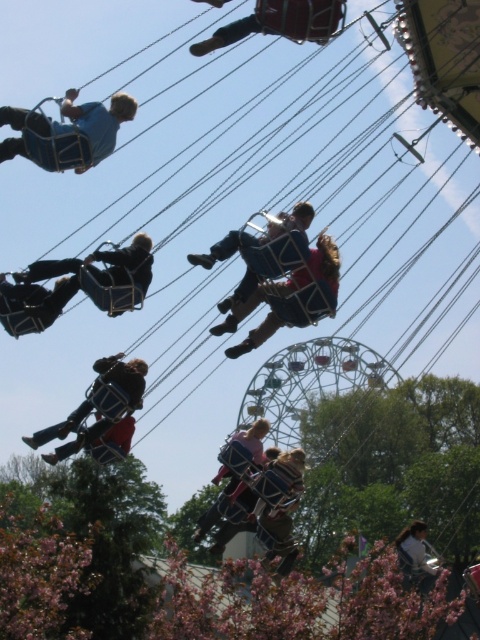
Question: Which point is farther to the camera?

Choices:
 (A) metallic blue helmet at lower left
 (B) metallic blue harness at center

Answer: (A)

Question: Which object is closer to the camera taking this photo?

Choices:
 (A) matte black harness at left
 (B) light brown fabric swing at lower right
 (C) matte blue harness at upper left

Answer: (C)

Question: Does matte blue harness at upper left have a greater width compared to matte blue chair at center?

Choices:
 (A) no
 (B) yes

Answer: (B)

Question: Which point is closer to the camera?

Choices:
 (A) matte blue harness at upper left
 (B) metallic blue helmet at upper center
 (C) matte black harness at left

Answer: (B)

Question: Is the position of metallic blue harness at center less distant than that of matte black harness at left?

Choices:
 (A) no
 (B) yes

Answer: (B)

Question: Can you confirm if metallic blue helmet at lower left is smaller than matte blue chair at center?

Choices:
 (A) no
 (B) yes

Answer: (A)